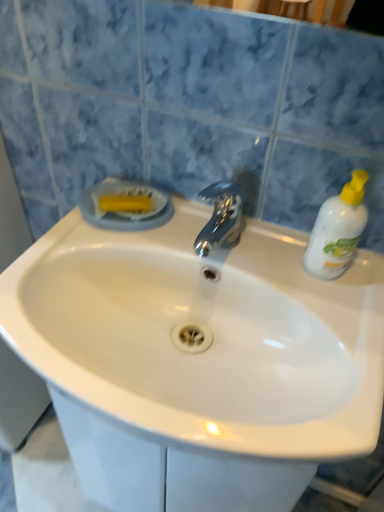
Describe the element at coordinates (210, 334) in the screenshot. This screenshot has width=384, height=512. I see `white glossy sink at center` at that location.

Image resolution: width=384 pixels, height=512 pixels. I want to click on white glossy sink at center, so click(x=210, y=334).

The height and width of the screenshot is (512, 384). I want to click on white plastic bottle at right, so click(337, 229).

This screenshot has height=512, width=384. What do you see at coordinates (337, 229) in the screenshot?
I see `white plastic bottle at right` at bounding box center [337, 229].

Where is `white glossy sink at center`? The height and width of the screenshot is (512, 384). white glossy sink at center is located at coordinates (210, 334).

Considering the relative positions of white plastic bottle at right and white glossy sink at center in the image provided, is white plastic bottle at right to the left or to the right of white glossy sink at center?

white plastic bottle at right is positioned on white glossy sink at center's right side.

Is white plastic bottle at right in front of white glossy sink at center?

No, white plastic bottle at right is behind white glossy sink at center.

Is point (347, 246) positioned behind point (293, 374)?

Yes, point (347, 246) is behind point (293, 374).

From the image's perspective, which one is positioned higher, white plastic bottle at right or white glossy sink at center?

From the image's view, white plastic bottle at right is above.

From a real-world perspective, between white plastic bottle at right and white glossy sink at center, who is vertically higher?

From a 3D spatial view, white plastic bottle at right is above.

Does white plastic bottle at right have a lesser width compared to white glossy sink at center?

Correct, the width of white plastic bottle at right is less than that of white glossy sink at center.

Which of these two, white plastic bottle at right or white glossy sink at center, stands taller?

With more height is white plastic bottle at right.

Is white plastic bottle at right smaller than white glossy sink at center?

Yes, white plastic bottle at right is smaller than white glossy sink at center.

Can white glossy sink at center be found inside white plastic bottle at right?

No, white glossy sink at center is not a part of white plastic bottle at right.

Is the surface of white plastic bottle at right in direct contact with white glossy sink at center?

They are not placed beside each other.

Is white plastic bottle at right facing away from white glossy sink at center?

white plastic bottle at right is not turned away from white glossy sink at center.

At what (x,y) coordinates should I click in order to perform the action: click on sink located underneath the white plastic bottle at right (from a real-world perspective). Please return your answer as a coordinate pair (x, y). The width and height of the screenshot is (384, 512). Looking at the image, I should click on (210, 334).

Considering the relative positions of white glossy sink at center and white plastic bottle at right in the image provided, is white glossy sink at center to the right of white plastic bottle at right from the viewer's perspective?

No.

Which is behind, white glossy sink at center or white plastic bottle at right?

white plastic bottle at right is further from the camera.

Between point (247, 454) and point (327, 250), which one is positioned behind?

The point (327, 250) is more distant.

From the image's perspective, is white glossy sink at center positioned above or below white plastic bottle at right?

white glossy sink at center is situated lower than white plastic bottle at right in the image.

From a real-world perspective, is white glossy sink at center above or below white plastic bottle at right?

white glossy sink at center is situated lower than white plastic bottle at right in the real world.

Between white glossy sink at center and white plastic bottle at right, which one has smaller width?

Thinner between the two is white plastic bottle at right.

Who is taller, white glossy sink at center or white plastic bottle at right?

With more height is white plastic bottle at right.

Can you confirm if white glossy sink at center is bigger than white plastic bottle at right?

Indeed, white glossy sink at center has a larger size compared to white plastic bottle at right.

Consider the image. Is white glossy sink at center situated inside white plastic bottle at right or outside?

The correct answer is: outside.

Consider the image. Does white glossy sink at center touch white plastic bottle at right?

white glossy sink at center and white plastic bottle at right are clearly separated.

Could you tell me if white glossy sink at center is turned towards white plastic bottle at right?

No, white glossy sink at center is not facing towards white plastic bottle at right.

Locate an element on the screen. cleaning product above the white glossy sink at center (from the image's perspective) is located at coordinates (337, 229).

You are a GUI agent. You are given a task and a screenshot of the screen. Output one action in this format:
    pyautogui.click(x=<x>, y=<y>)
    Task: Click on the cleaning product behind the white glossy sink at center
    The image size is (384, 512).
    Given the screenshot: What is the action you would take?
    pyautogui.click(x=337, y=229)

In order to click on sink on the left of white plastic bottle at right in this screenshot , I will do `click(210, 334)`.